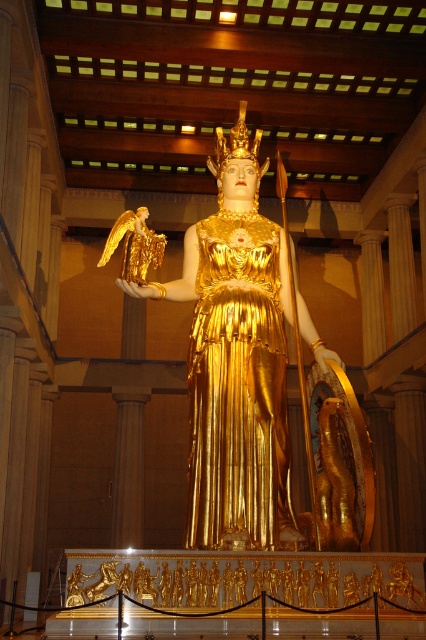
Question: Estimate the real-world distances between objects in this image. Which object is closer to the goldmaterial/texturestatue at center?

Choices:
 (A) gold textured crown at center
 (B) gold metallic angel at upper left

Answer: (B)

Question: Is gold metallic dress at center above gold textured crown at center?

Choices:
 (A) no
 (B) yes

Answer: (A)

Question: Does gold metallic angel at upper left appear over gold textured crown at center?

Choices:
 (A) yes
 (B) no

Answer: (B)

Question: Which point is farther to the camera?

Choices:
 (A) (247, 225)
 (B) (261, 225)
 (C) (141, 212)
 (D) (253, 148)

Answer: (D)

Question: Which is nearer to the gold textured crown at center?

Choices:
 (A) gold metallic dress at center
 (B) gold metallic angel at upper left

Answer: (B)

Question: Is gold metallic dress at center smaller than gold textured crown at center?

Choices:
 (A) yes
 (B) no

Answer: (B)